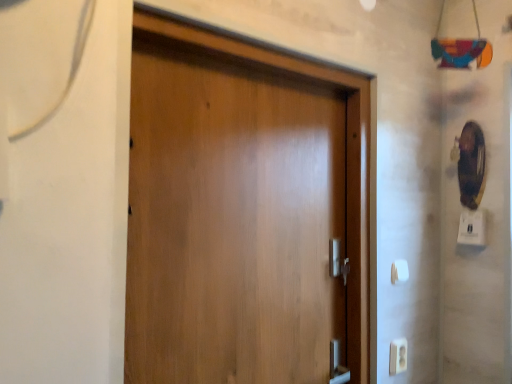
This screenshot has height=384, width=512. Find the location of `wooden door at center`. wooden door at center is located at coordinates (238, 220).

Identify the location of wooden door at center. The image size is (512, 384). (238, 220).

Which of these two, wooden door at center or white plastic electric outlet at lower right, is smaller?

white plastic electric outlet at lower right is smaller.

Does wooden door at center have a greater height compared to white plastic electric outlet at lower right?

Yes, wooden door at center is taller than white plastic electric outlet at lower right.

Based on the photo, is wooden door at center looking in the opposite direction of white plastic electric outlet at lower right?

No.

Based on the photo, from the image's perspective, which is below, white plastic electric outlet at lower right or white plastic light switch at lower right, marked as the 2th light switch in a top-to-bottom arrangement?

From the image's view, white plastic electric outlet at lower right is below.

Is white plastic electric outlet at lower right oriented away from white plastic light switch at lower right, marked as the 1th light switch in a left-to-right arrangement?

No.

Are white plastic electric outlet at lower right and white plastic light switch at lower right, marked as the 2th light switch in a top-to-bottom arrangement, located far from each other?

They are positioned close to each other.

Is point (402, 342) closer or farther from the camera than point (399, 271)?

Point (402, 342) appears to be farther away from the viewer than point (399, 271).

Between white plastic electric outlet at lower right and white plastic light switch at right, which appears as the 2th light switch when viewed from the left, which one has larger size?

white plastic light switch at right, which appears as the 2th light switch when viewed from the left.

Is white plastic electric outlet at lower right positioned with its back to white plastic light switch at right, which ranks as the 2th light switch in bottom-to-top order?

No, white plastic electric outlet at lower right is not facing the opposite direction of white plastic light switch at right, which ranks as the 2th light switch in bottom-to-top order.

Can you confirm if white plastic electric outlet at lower right is shorter than white plastic light switch at right, which is the 1th light switch from right to left?

Yes, white plastic electric outlet at lower right is shorter than white plastic light switch at right, which is the 1th light switch from right to left.

Is there a large distance between white plastic light switch at right, which appears as the 2th light switch when viewed from the left, and white plastic light switch at lower right, marked as the 2th light switch in a top-to-bottom arrangement?

No, white plastic light switch at right, which appears as the 2th light switch when viewed from the left, is not far from white plastic light switch at lower right, marked as the 2th light switch in a top-to-bottom arrangement.

From the picture: Can you confirm if white plastic light switch at right, which is the 1th light switch from right to left, is taller than white plastic light switch at lower right, positioned as the 1th light switch in bottom-to-top order?

Yes, white plastic light switch at right, which is the 1th light switch from right to left, is taller than white plastic light switch at lower right, positioned as the 1th light switch in bottom-to-top order.

From a real-world perspective, which is physically above, white plastic light switch at right, which ranks as the 2th light switch in bottom-to-top order, or white plastic light switch at lower right, marked as the 2th light switch in a top-to-bottom arrangement?

white plastic light switch at right, which ranks as the 2th light switch in bottom-to-top order, from a real-world perspective.

Does white plastic light switch at right, arranged as the 1th light switch when viewed from the top, appear on the right side of white plastic light switch at lower right, marked as the 2th light switch in a top-to-bottom arrangement?

Yes, white plastic light switch at right, arranged as the 1th light switch when viewed from the top, is to the right of white plastic light switch at lower right, marked as the 2th light switch in a top-to-bottom arrangement.

From a real-world perspective, between white plastic light switch at lower right, marked as the 1th light switch in a left-to-right arrangement, and white plastic electric outlet at lower right, who is vertically lower?

In real-world perspective, white plastic electric outlet at lower right is lower.

Identify the location of electric outlet to the left of white plastic light switch at lower right, the second light switch from the right. The width and height of the screenshot is (512, 384). (398, 356).

Which object is further away from the camera, white plastic light switch at lower right, the second light switch from the right, or white plastic electric outlet at lower right?

Positioned behind is white plastic light switch at lower right, the second light switch from the right.

Which of these two, white plastic light switch at lower right, marked as the 1th light switch in a left-to-right arrangement, or white plastic electric outlet at lower right, is smaller?

white plastic light switch at lower right, marked as the 1th light switch in a left-to-right arrangement.

Is white plastic light switch at right, which ranks as the 2th light switch in bottom-to-top order, facing towards wooden door at center?

No, white plastic light switch at right, which ranks as the 2th light switch in bottom-to-top order, does not turn towards wooden door at center.

Identify the location of door in front of the white plastic light switch at right, arranged as the 1th light switch when viewed from the top. (238, 220).

Which object is more forward, white plastic light switch at right, which appears as the 2th light switch when viewed from the left, or wooden door at center?

wooden door at center.

Is white plastic light switch at lower right, marked as the 2th light switch in a top-to-bottom arrangement, far from white plastic light switch at right, arranged as the 1th light switch when viewed from the top?

No, there isn't a large distance between white plastic light switch at lower right, marked as the 2th light switch in a top-to-bottom arrangement, and white plastic light switch at right, arranged as the 1th light switch when viewed from the top.

Between point (394, 271) and point (459, 222), which one is positioned behind?

The point (459, 222) is behind.

Which of these two, white plastic light switch at lower right, the second light switch from the right, or white plastic light switch at right, which ranks as the 2th light switch in bottom-to-top order, is wider?

With larger width is white plastic light switch at right, which ranks as the 2th light switch in bottom-to-top order.

Is white plastic light switch at right, arranged as the 1th light switch when viewed from the top, a part of white plastic light switch at lower right, positioned as the 1th light switch in bottom-to-top order?

Definitely not — white plastic light switch at right, arranged as the 1th light switch when viewed from the top, is not inside white plastic light switch at lower right, positioned as the 1th light switch in bottom-to-top order.

Where is `door in front of the white plastic electric outlet at lower right`? Image resolution: width=512 pixels, height=384 pixels. door in front of the white plastic electric outlet at lower right is located at coordinates (238, 220).

From the image's perspective, starting from the white plastic electric outlet at lower right, which light switch is the 1st one above? Please provide its 2D coordinates.

[(399, 271)]

Estimate the real-world distances between objects in this image. Which object is closer to white plastic light switch at lower right, marked as the 1th light switch in a left-to-right arrangement, white plastic light switch at right, which ranks as the 2th light switch in bottom-to-top order, or wooden door at center?

The object closer to white plastic light switch at lower right, marked as the 1th light switch in a left-to-right arrangement, is white plastic light switch at right, which ranks as the 2th light switch in bottom-to-top order.

Considering their positions, is white plastic light switch at right, which is the 1th light switch from right to left, positioned further to wooden door at center than white plastic electric outlet at lower right?

Among the two, white plastic light switch at right, which is the 1th light switch from right to left, is located further to wooden door at center.

When comparing their distances from white plastic light switch at lower right, marked as the 2th light switch in a top-to-bottom arrangement, does wooden door at center or white plastic light switch at right, which ranks as the 2th light switch in bottom-to-top order, seem further?

wooden door at center is further to white plastic light switch at lower right, marked as the 2th light switch in a top-to-bottom arrangement.

Which object lies nearer to the anchor point white plastic electric outlet at lower right, wooden door at center or white plastic light switch at right, which is the 1th light switch from right to left?

Based on the image, white plastic light switch at right, which is the 1th light switch from right to left, appears to be nearer to white plastic electric outlet at lower right.

Which object lies nearer to the anchor point white plastic electric outlet at lower right, wooden door at center or white plastic light switch at lower right, marked as the 2th light switch in a top-to-bottom arrangement?

Among the two, white plastic light switch at lower right, marked as the 2th light switch in a top-to-bottom arrangement, is located nearer to white plastic electric outlet at lower right.

Looking at the image, which one is located closer to white plastic light switch at lower right, positioned as the 1th light switch in bottom-to-top order, white plastic electric outlet at lower right or white plastic light switch at right, which ranks as the 2th light switch in bottom-to-top order?

white plastic electric outlet at lower right is closer to white plastic light switch at lower right, positioned as the 1th light switch in bottom-to-top order.

Based on their spatial positions, is white plastic light switch at lower right, marked as the 1th light switch in a left-to-right arrangement, or white plastic light switch at right, which appears as the 2th light switch when viewed from the left, closer to wooden door at center?

white plastic light switch at lower right, marked as the 1th light switch in a left-to-right arrangement, is positioned closer to the anchor wooden door at center.

Which object lies nearer to the anchor point white plastic electric outlet at lower right, white plastic light switch at lower right, marked as the 1th light switch in a left-to-right arrangement, or wooden door at center?

Based on the image, white plastic light switch at lower right, marked as the 1th light switch in a left-to-right arrangement, appears to be nearer to white plastic electric outlet at lower right.

Locate an element on the screen. electric outlet between wooden door at center and white plastic light switch at lower right, the second light switch from the right, in the front-back direction is located at coordinates (398, 356).

Locate an element on the screen. The height and width of the screenshot is (384, 512). light switch between wooden door at center and white plastic light switch at right, arranged as the 1th light switch when viewed from the top, in the horizontal direction is located at coordinates (399, 271).

Locate an element on the screen. electric outlet between wooden door at center and white plastic light switch at right, which appears as the 2th light switch when viewed from the left, from left to right is located at coordinates (398, 356).

At what (x,y) coordinates should I click in order to perform the action: click on light switch between white plastic light switch at right, which is the 1th light switch from right to left, and white plastic electric outlet at lower right in the up-down direction. Please return your answer as a coordinate pair (x, y). This screenshot has width=512, height=384. Looking at the image, I should click on (399, 271).